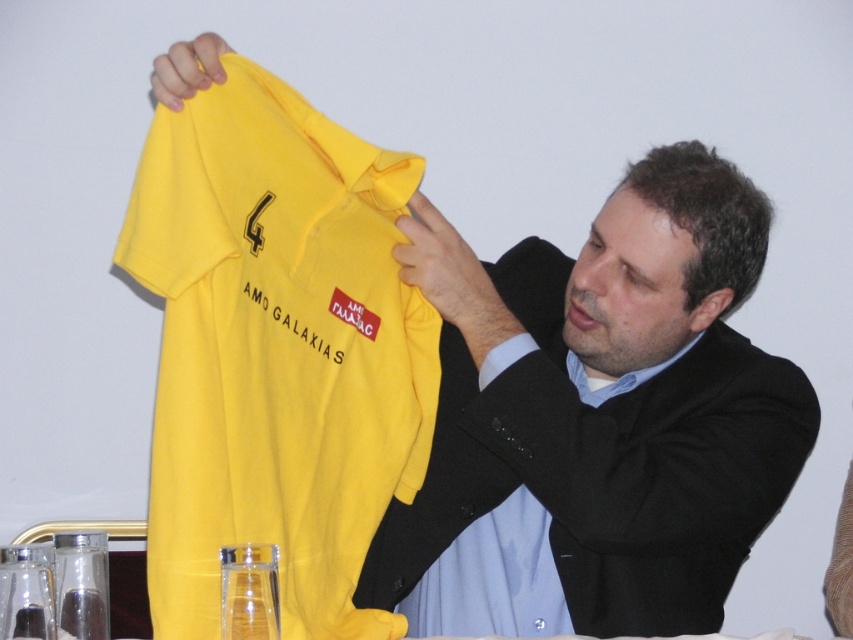
Is matte yellow shirt at center taller than matte yellow shirt at upper center?

Indeed, matte yellow shirt at center has a greater height compared to matte yellow shirt at upper center.

Between point (550, 472) and point (468, 621), which one is positioned in front?

Point (550, 472) is in front.

You are a GUI agent. You are given a task and a screenshot of the screen. Output one action in this format:
    pyautogui.click(x=<x>, y=<y>)
    Task: Click on the matte yellow shirt at center
    The height and width of the screenshot is (640, 853).
    Given the screenshot: What is the action you would take?
    pyautogui.click(x=602, y=424)